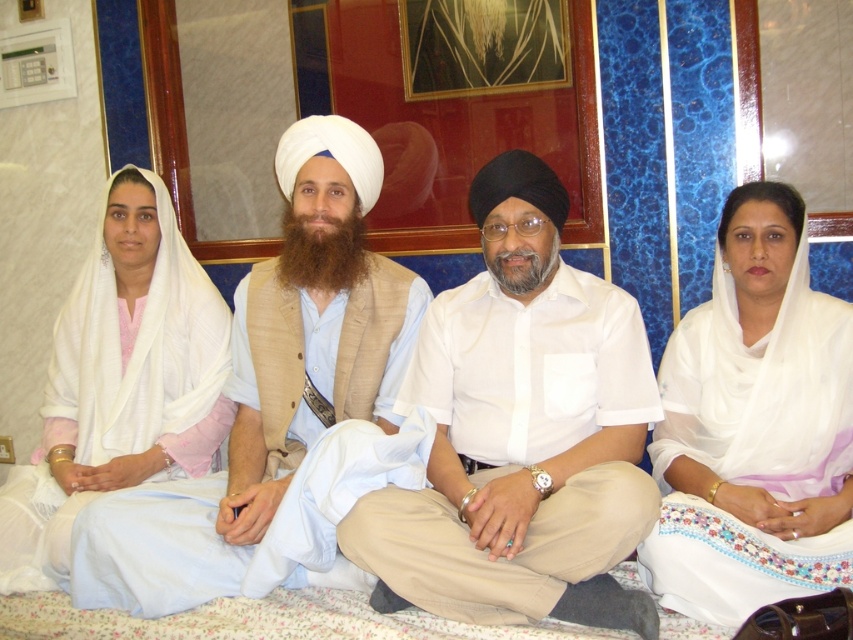
Question: Estimate the real-world distances between objects in this image. Which object is farther from the white sheer scarf at right?

Choices:
 (A) white satin shawl at left
 (B) white cotton robe at center

Answer: (A)

Question: Considering the real-world distances, which object is closest to the white cotton robe at center?

Choices:
 (A) white sheer scarf at right
 (B) white satin shawl at left

Answer: (B)

Question: Is white cotton shirt at center to the right of white cotton robe at center from the viewer's perspective?

Choices:
 (A) yes
 (B) no

Answer: (A)

Question: Which point is farther to the camera?

Choices:
 (A) white cotton shirt at center
 (B) white sheer scarf at right
 (C) white cotton robe at center

Answer: (C)

Question: Is white cotton shirt at center above white cotton robe at center?

Choices:
 (A) yes
 (B) no

Answer: (A)

Question: Is white cotton shirt at center thinner than white satin shawl at left?

Choices:
 (A) yes
 (B) no

Answer: (B)